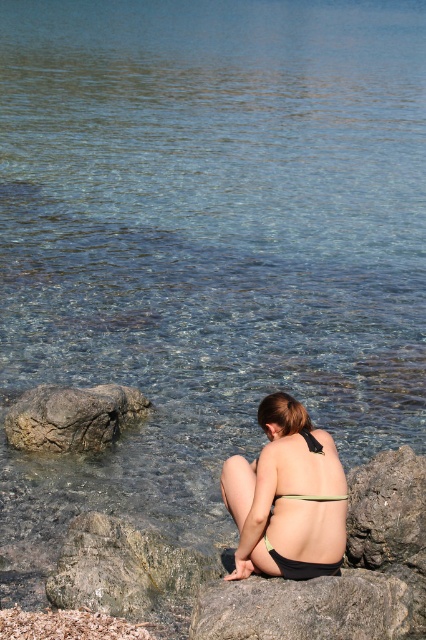
Can you confirm if black bikini bottom at lower center is bigger than green mossy rock at lower left?

Yes.

Where is `black bikini bottom at lower center`? black bikini bottom at lower center is located at coordinates (287, 497).

Image resolution: width=426 pixels, height=640 pixels. Describe the element at coordinates (287, 497) in the screenshot. I see `black bikini bottom at lower center` at that location.

This screenshot has height=640, width=426. I want to click on black bikini bottom at lower center, so click(287, 497).

Based on the photo, how much distance is there between black bikini bottom at lower center and gray rough rock at lower left?

The distance of black bikini bottom at lower center from gray rough rock at lower left is 2.33 meters.

Who is positioned more to the right, black bikini bottom at lower center or gray rough rock at lower left?

black bikini bottom at lower center is more to the right.

Does point (319, 541) come closer to viewer compared to point (75, 392)?

Yes, point (319, 541) is closer to viewer.

At what (x,y) coordinates should I click in order to perform the action: click on black bikini bottom at lower center. Please return your answer as a coordinate pair (x, y). The image size is (426, 640). Looking at the image, I should click on (287, 497).

Can you confirm if green mossy rock at lower left is thinner than gray rough rock at lower left?

Correct, green mossy rock at lower left's width is less than gray rough rock at lower left's.

Based on the photo, is green mossy rock at lower left above gray rough rock at lower left?

No, green mossy rock at lower left is not above gray rough rock at lower left.

You are a GUI agent. You are given a task and a screenshot of the screen. Output one action in this format:
    pyautogui.click(x=<x>, y=<y>)
    Task: Click on the green mossy rock at lower left
    The width and height of the screenshot is (426, 640).
    Given the screenshot: What is the action you would take?
    pyautogui.click(x=124, y=568)